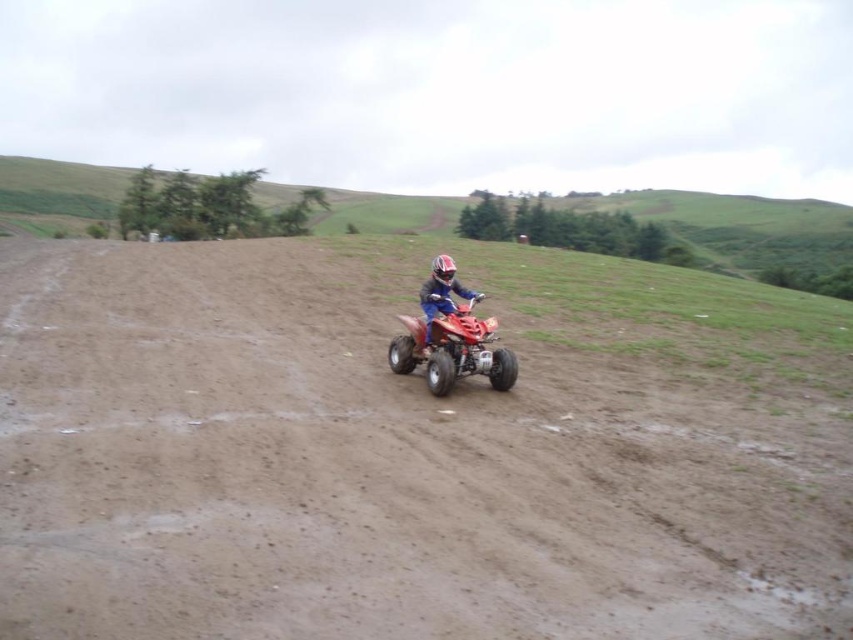
From the picture: You are a photographer standing at the edge of the brown sandy terrain at center. You want to take a photo of the shiny red quad bike at center. Which object will appear larger in the photo?

The brown sandy terrain at center will appear larger in the photo because it is much taller than the shiny red quad bike at center.

You are standing at the starting point of the dirt track and want to reach the end of the track. There are two points marked on the track, point 1 at coordinates point (24, 493) and point 2 at coordinates point (444, 253). Which point should you head towards first if you want to take the shortest path to the end?

Point 1 at coordinates point (24, 493) is closer to the viewer than point (444, 253), so you should head towards point 1 first to take the shortest path.

You are a photographer planning to capture both the shiny red quad bike at center and the matte orange quad bike at center in a single frame. Given their widths, which bike would require you to adjust your camera angle to include its full width in the shot?

The shiny red quad bike at center has a greater width than the matte orange quad bike at center, so you would need to adjust your camera angle to accommodate its wider size to include its full width in the shot.